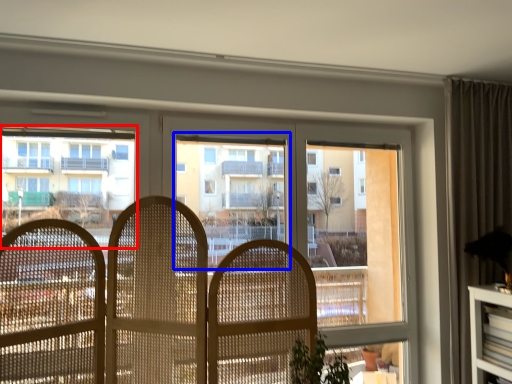
Question: Which point is closer to the camera, condominium (highlighted by a red box) or bay window (highlighted by a blue box)?

Choices:
 (A) condominium
 (B) bay window

Answer: (A)